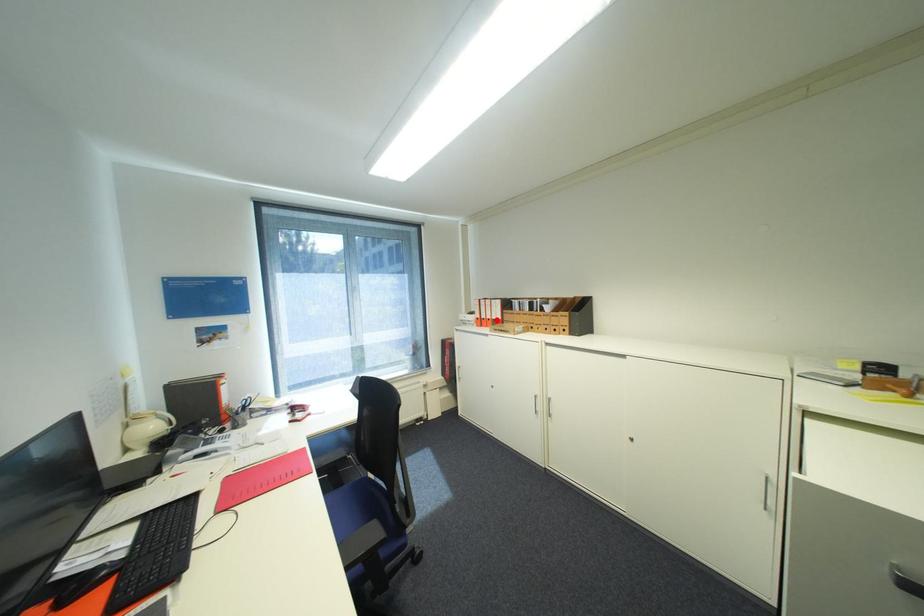
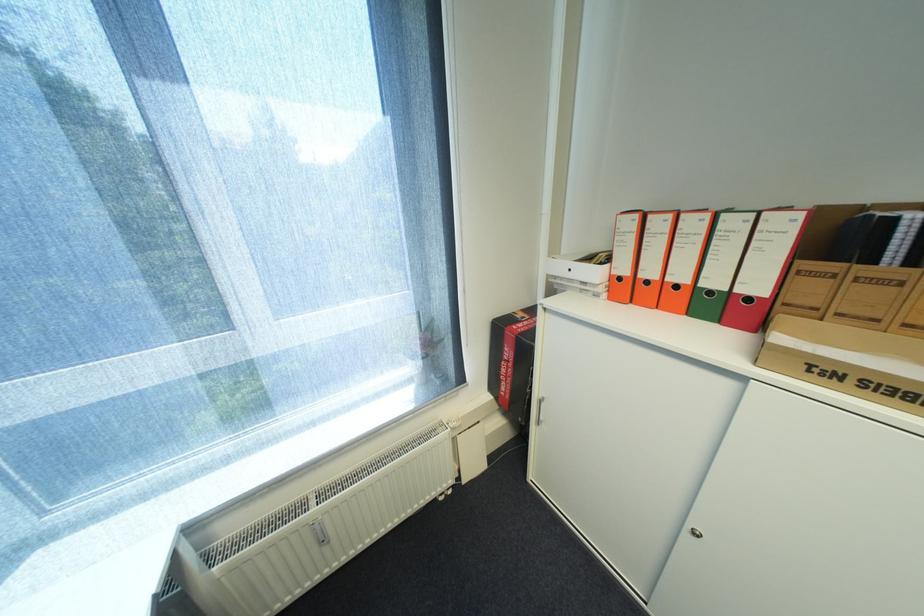
In the second image, find the point that corresponds to the highlighted location in the first image.

(685, 286)